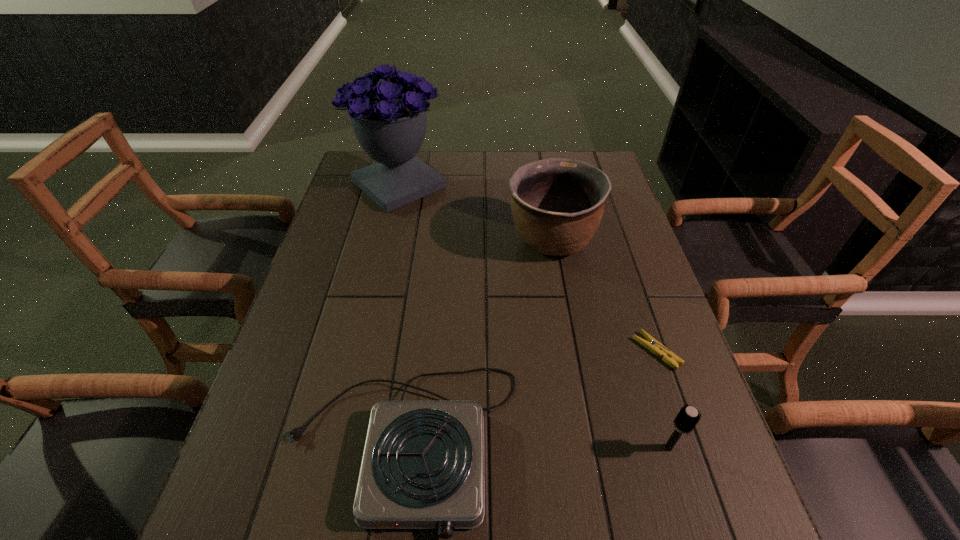
You are a GUI agent. You are given a task and a screenshot of the screen. Output one action in this format:
    pyautogui.click(x=<x>, y=<y>)
    Task: Click on the pottery situated at the right edge
    
    Given the screenshot: What is the action you would take?
    pyautogui.click(x=557, y=204)

You are a GUI agent. You are given a task and a screenshot of the screen. Output one action in this format:
    pyautogui.click(x=<x>, y=<y>)
    Task: Click on the hairbrush present at the right edge
    This screenshot has height=540, width=960.
    Given the screenshot: What is the action you would take?
    pyautogui.click(x=687, y=418)

The height and width of the screenshot is (540, 960). Identify the location of clothespin that is at the right edge. click(652, 344).

Where is `object located in the far left corner section of the desktop`? This screenshot has height=540, width=960. object located in the far left corner section of the desktop is located at coordinates click(x=389, y=121).

In the image, there is a desktop. Identify the location of vacant space at the far edge. (544, 153).

Where is `free space at the left edge of the desktop`? This screenshot has width=960, height=540. free space at the left edge of the desktop is located at coordinates (337, 267).

This screenshot has height=540, width=960. In the image, there is a desktop. In order to click on vacant region at the right edge in this screenshot , I will do `click(613, 268)`.

This screenshot has height=540, width=960. In order to click on vacant space at the far right corner in this screenshot , I will do `click(610, 177)`.

Image resolution: width=960 pixels, height=540 pixels. Find the location of `free space between the bouquet and the shortest object`. free space between the bouquet and the shortest object is located at coordinates (528, 268).

You are a GUI agent. You are given a task and a screenshot of the screen. Output one action in this format:
    pyautogui.click(x=<x>, y=<y>)
    Task: Click on the vacant space that is in between the pottery and the tallest object
    This screenshot has height=540, width=960.
    Given the screenshot: What is the action you would take?
    (x=475, y=213)